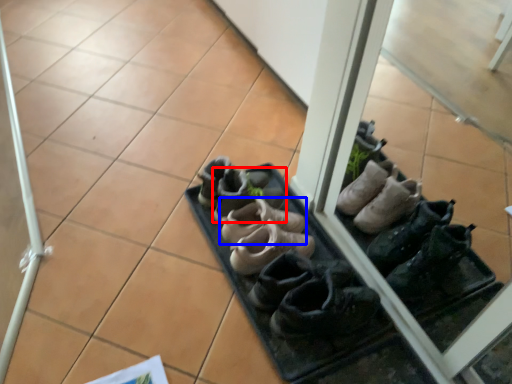
Question: Which point is further to the camera, footwear (highlighted by a red box) or footwear (highlighted by a blue box)?

Choices:
 (A) footwear
 (B) footwear

Answer: (A)